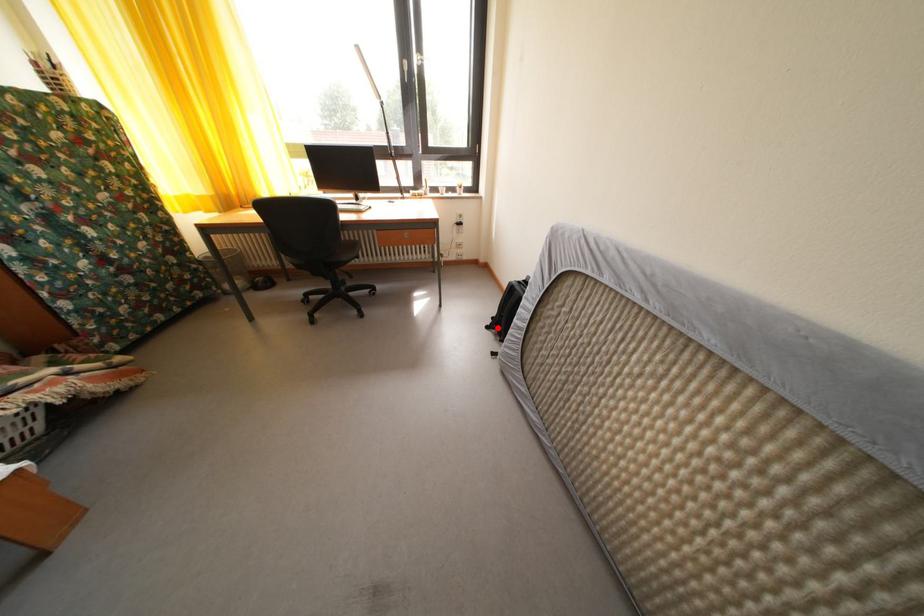
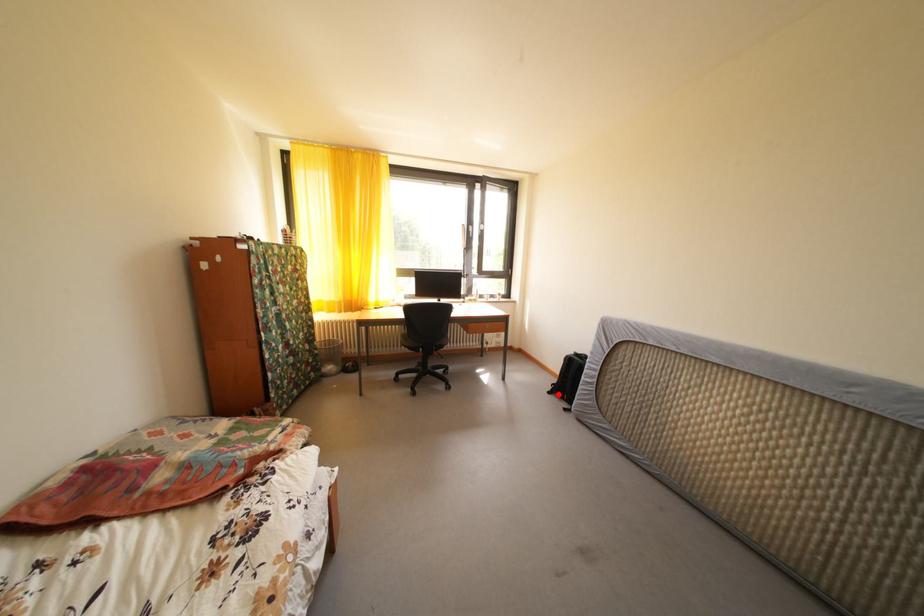
I am providing you with two images of the same scene from different viewpoints. A red point is marked on the first image and another point is marked on the second image. Do the highlighted points in image1 and image2 indicate the same real-world spot?

Yes